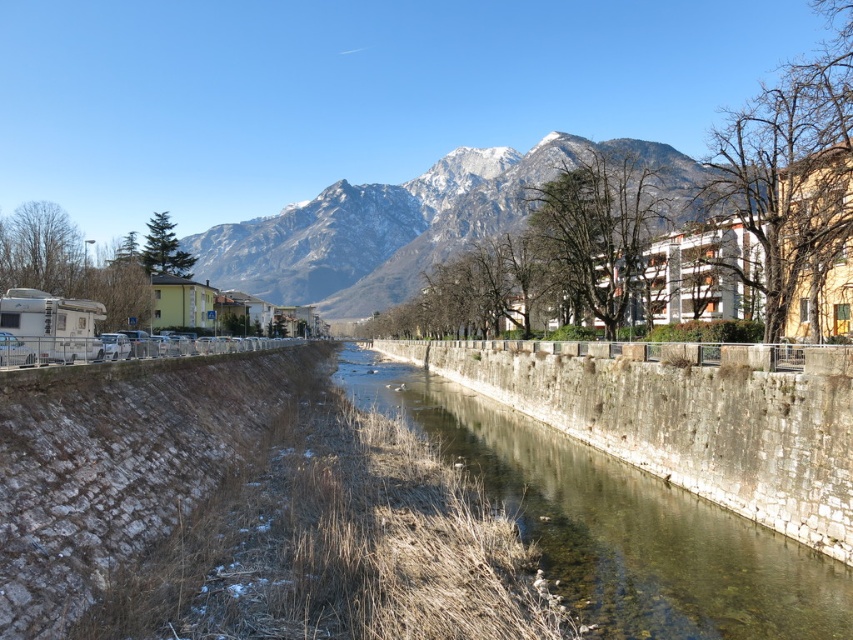
Is clear stone wall at center shorter than snowy rock mountain at upper center?

Yes.

Looking at this image, can you confirm if clear stone wall at center is positioned to the left of snowy rock mountain at upper center?

Indeed, clear stone wall at center is positioned on the left side of snowy rock mountain at upper center.

Between point (606, 532) and point (277, 248), which one is positioned behind?

The point (277, 248) is behind.

Where is `clear stone wall at center`? The image size is (853, 640). clear stone wall at center is located at coordinates (614, 524).